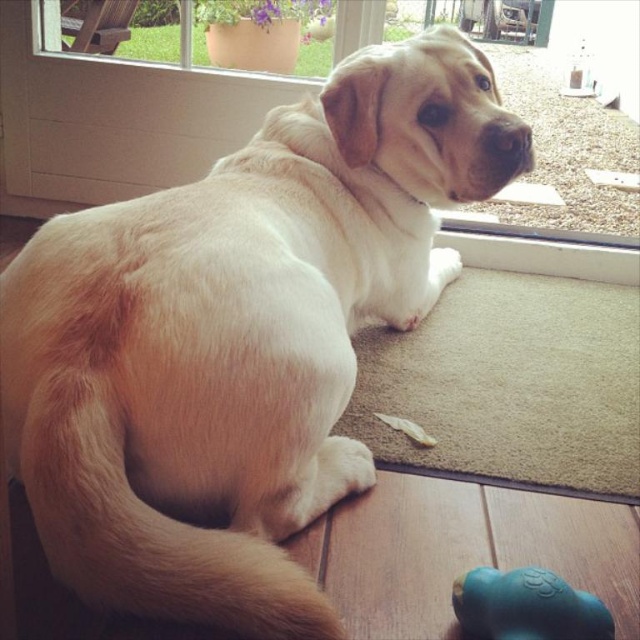
Question: Does transparent glass window at upper center appear on the right side of teal rubber dog toy at lower right?

Choices:
 (A) no
 (B) yes

Answer: (B)

Question: Is the position of transparent glass window at upper center more distant than that of teal rubber dog toy at lower right?

Choices:
 (A) no
 (B) yes

Answer: (B)

Question: Among these points, which one is farthest from the camera?

Choices:
 (A) (509, 588)
 (B) (577, 115)

Answer: (B)

Question: Does transparent glass window at upper center appear under teal rubber dog toy at lower right?

Choices:
 (A) no
 (B) yes

Answer: (A)

Question: Which point appears closest to the camera in this image?

Choices:
 (A) (48, 141)
 (B) (467, 618)

Answer: (B)